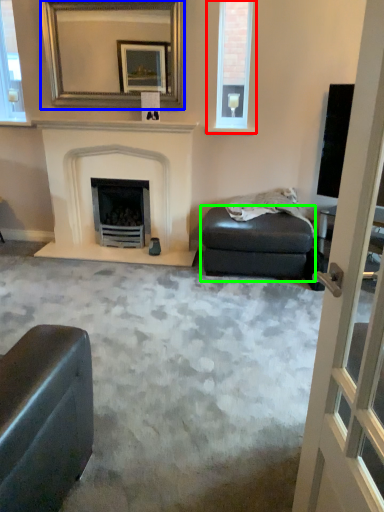
Question: Estimate the real-world distances between objects in this image. Which object is farther from window (highlighted by a red box), mirror (highlighted by a blue box) or footrest (highlighted by a green box)?

Choices:
 (A) mirror
 (B) footrest

Answer: (B)